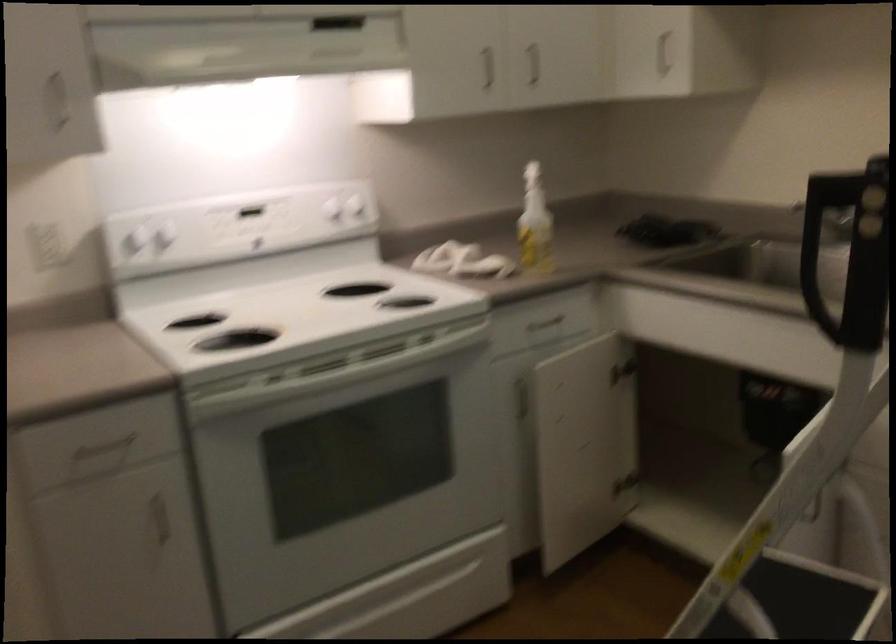
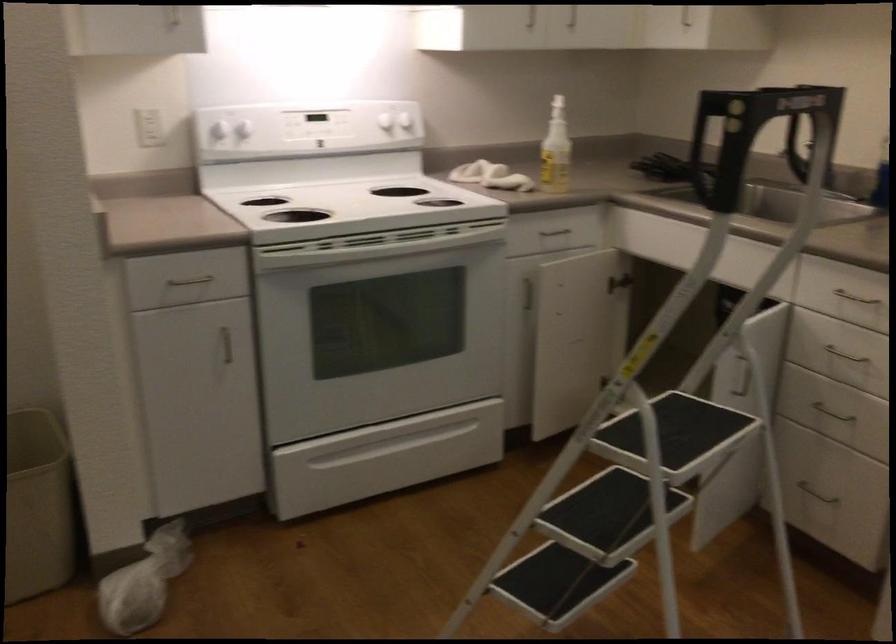
Question: The images are taken continuously from a first-person perspective. In which direction is your viewpoint rotating?

Choices:
 (A) Left
 (B) Right
 (C) Up
 (D) Down

Answer: (D)